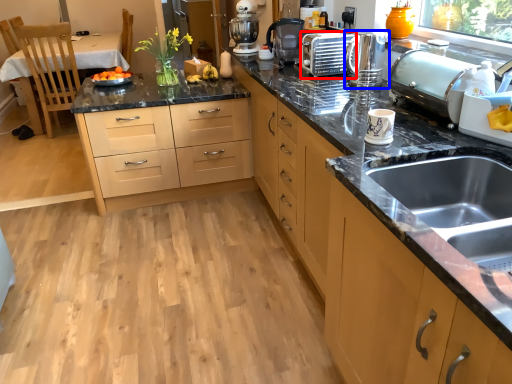
Question: Which of the following is the closest to the observer, appliance (highlighted by a red box) or kitchen appliance (highlighted by a blue box)?

Choices:
 (A) appliance
 (B) kitchen appliance

Answer: (B)